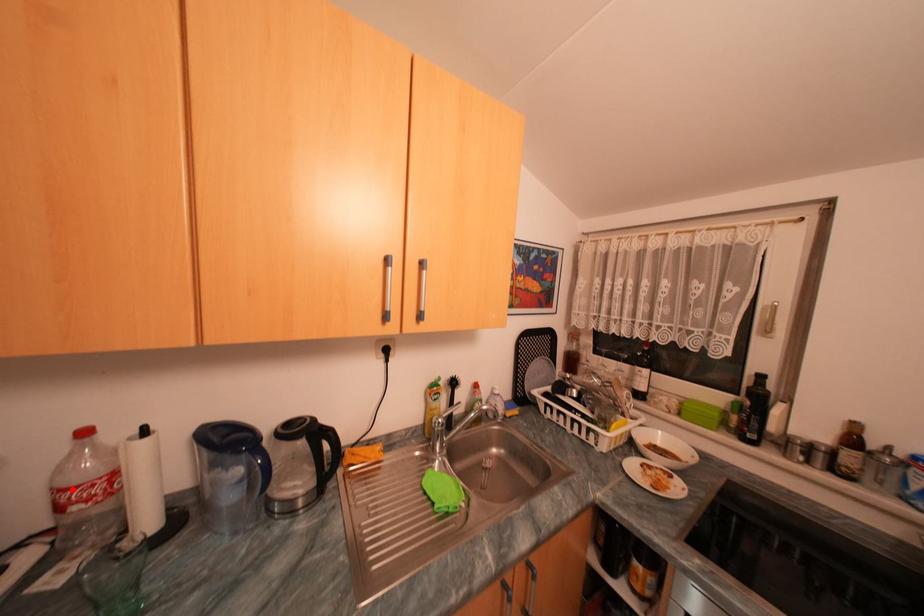
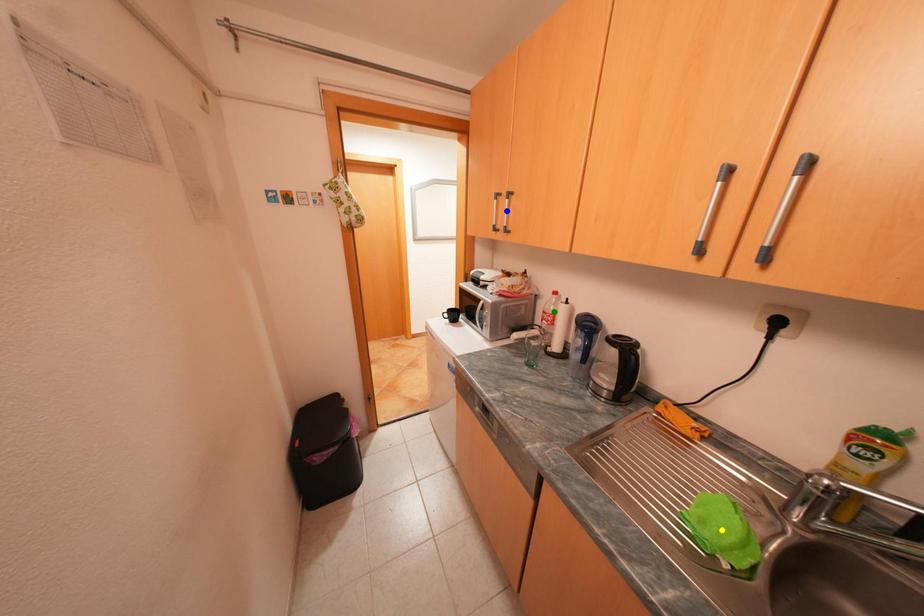
Question: I am providing you with two images of the same scene from different viewpoints. A red point is marked on the first image. You are given multiple points on the second image. Which point in image 2 is actually the same real-world point as the red point in image 1?

Choices:
 (A) yellow point
 (B) blue point
 (C) green point

Answer: (C)